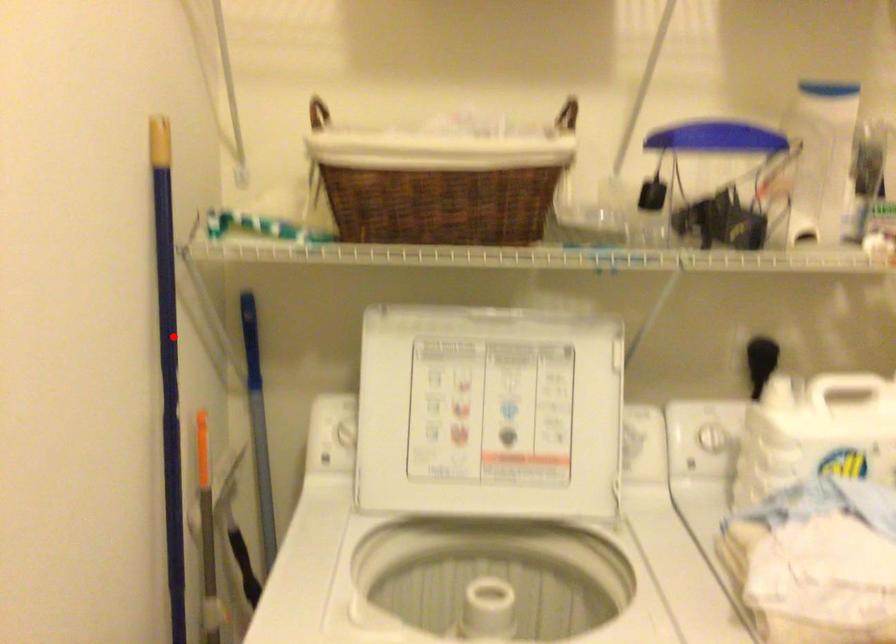
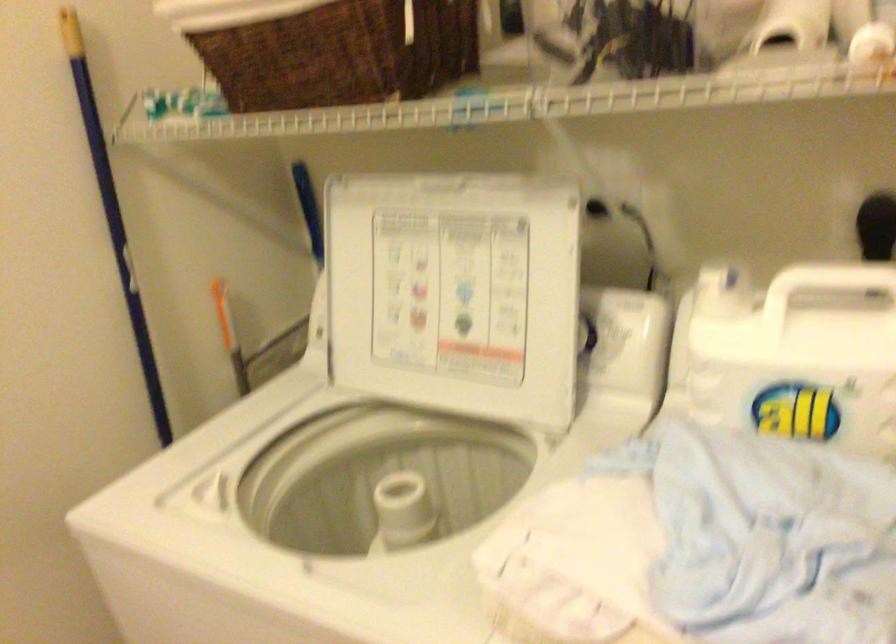
The point at the highlighted location is marked in the first image. Where is the corresponding point in the second image?

(113, 216)